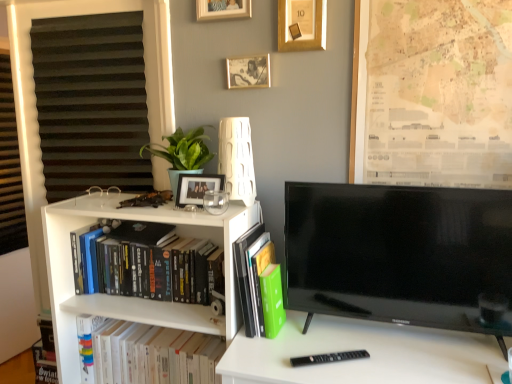
You are a GUI agent. You are given a task and a screenshot of the screen. Output one action in this format:
    pyautogui.click(x=<x>, y=<y>)
    Task: Click on the blank space above white matte desk at center (from a real-world perspective)
    The image size is (512, 384).
    Given the screenshot: What is the action you would take?
    pyautogui.click(x=370, y=346)